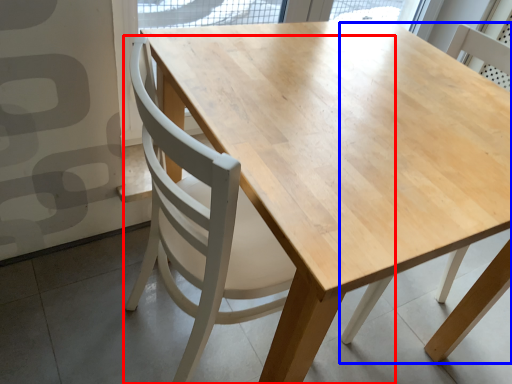
Question: Which object is closer to the camera taking this photo, chair (highlighted by a red box) or chair (highlighted by a blue box)?

Choices:
 (A) chair
 (B) chair

Answer: (A)